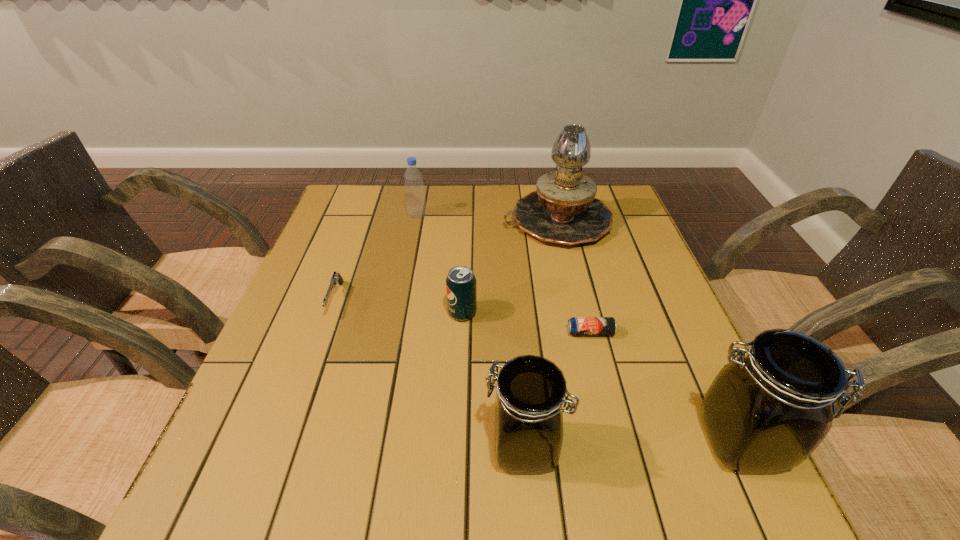
Identify which object is the closest to the shorter jar. Please provide its 2D coordinates. Your answer should be formatted as a tuple, i.e. [(x, y)], where the tuple contains the x and y coordinates of a point satisfying the conditions above.

[(577, 326)]

Where is `free space that satisfies the following two spatial constraints: 1. on the front side of the tallest object; 2. on the left side of the sixth object from right to left`? The image size is (960, 540). free space that satisfies the following two spatial constraints: 1. on the front side of the tallest object; 2. on the left side of the sixth object from right to left is located at coordinates (417, 221).

Locate an element on the screen. The width and height of the screenshot is (960, 540). free spot that satisfies the following two spatial constraints: 1. on the front side of the third nearest object; 2. on the lid of the shorter jar is located at coordinates (619, 447).